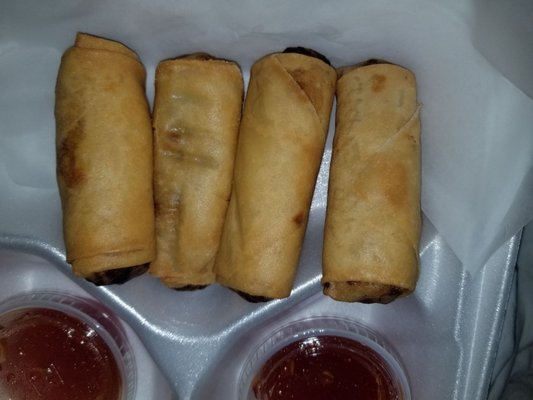
Image resolution: width=533 pixels, height=400 pixels. Identify the location of plastic container. (359, 362).